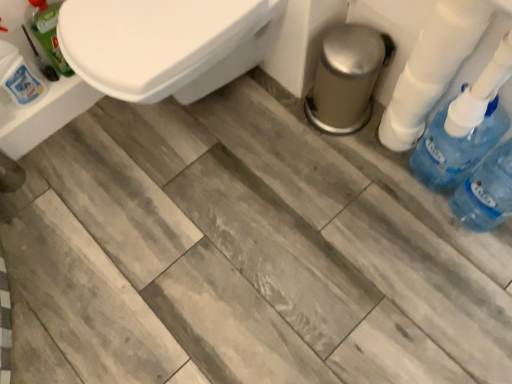
This screenshot has height=384, width=512. Find the location of `blue translucent bottle at right`. blue translucent bottle at right is located at coordinates (486, 192).

In order to face translucent green bottle at upper left, the 2th cleaning product positioned from the left, should I rotate leftwards or rightwards?

To align with it, rotate left about 25.118°.

This screenshot has width=512, height=384. I want to click on translucent plastic bottle at upper left, the third cleaning product when ordered from right to left, so click(18, 76).

Where is `blue translucent bottle at right`? The height and width of the screenshot is (384, 512). blue translucent bottle at right is located at coordinates (486, 192).

Consider the image. Which of these two, translucent green bottle at upper left, the 2th cleaning product positioned from the left, or blue translucent bottle at right, is bigger?

blue translucent bottle at right is bigger.

Is translucent green bottle at upper left, the 2th cleaning product positioned from the left, shorter than blue translucent bottle at right?

Yes, translucent green bottle at upper left, the 2th cleaning product positioned from the left, is shorter than blue translucent bottle at right.

Based on the photo, which is more to the left, translucent green bottle at upper left, marked as the second cleaning product in a right-to-left arrangement, or blue translucent bottle at right?

translucent green bottle at upper left, marked as the second cleaning product in a right-to-left arrangement.

Would you say translucent green bottle at upper left, the 2th cleaning product positioned from the left, contains blue translucent bottle at right?

That's incorrect, blue translucent bottle at right is not inside translucent green bottle at upper left, the 2th cleaning product positioned from the left.

From a real-world perspective, who is located lower, translucent plastic bottle at upper left, the first cleaning product in the left-to-right sequence, or white plastic toilet paper at right?

translucent plastic bottle at upper left, the first cleaning product in the left-to-right sequence.

Is point (31, 92) positioned after point (409, 147)?

Yes, it is behind point (409, 147).

Looking at this image, which object is further away from the camera taking this photo, translucent plastic bottle at upper left, the third cleaning product when ordered from right to left, or white plastic toilet paper at right?

translucent plastic bottle at upper left, the third cleaning product when ordered from right to left, is behind.

Looking at this image, is translucent plastic bottle at upper left, the first cleaning product in the left-to-right sequence, to the left or to the right of white plastic toilet paper at right in the image?

Based on their positions, translucent plastic bottle at upper left, the first cleaning product in the left-to-right sequence, is located to the left of white plastic toilet paper at right.

Is blue translucent bottle at right to the right of white plastic toilet paper at right from the viewer's perspective?

Yes, blue translucent bottle at right is to the right of white plastic toilet paper at right.

From a real-world perspective, is blue translucent bottle at right on top of white plastic toilet paper at right?

No, from a real-world perspective, blue translucent bottle at right is not over white plastic toilet paper at right

The image size is (512, 384). I want to click on bottle below the white plastic toilet paper at right (from the image's perspective), so click(x=486, y=192).

Is the depth of blue translucent bottle at right less than that of white plastic toilet paper at right?

No, blue translucent bottle at right is behind white plastic toilet paper at right.

Between point (478, 173) and point (476, 88), which one is positioned in front?

The point (476, 88) is closer.

From the image's perspective, is blue translucent bottle at right located above blue plastic bottle at right, which ranks as the third cleaning product in left-to-right order?

Incorrect, from the image's perspective, blue translucent bottle at right is lower than blue plastic bottle at right, which ranks as the third cleaning product in left-to-right order.

Are blue translucent bottle at right and blue plastic bottle at right, arranged as the 1th cleaning product when viewed from the right, far apart?

No, there isn't a large distance between blue translucent bottle at right and blue plastic bottle at right, arranged as the 1th cleaning product when viewed from the right.

Considering the sizes of blue translucent bottle at right and blue plastic bottle at right, arranged as the 1th cleaning product when viewed from the right, in the image, is blue translucent bottle at right bigger or smaller than blue plastic bottle at right, arranged as the 1th cleaning product when viewed from the right,?

blue translucent bottle at right is bigger than blue plastic bottle at right, arranged as the 1th cleaning product when viewed from the right.

From a real-world perspective, is blue translucent bottle at right located beneath translucent green bottle at upper left, the 2th cleaning product positioned from the left?

Yes, from a real-world perspective, blue translucent bottle at right is beneath translucent green bottle at upper left, the 2th cleaning product positioned from the left.

Does blue translucent bottle at right turn towards translucent green bottle at upper left, the 2th cleaning product positioned from the left?

No, blue translucent bottle at right does not turn towards translucent green bottle at upper left, the 2th cleaning product positioned from the left.

How far apart are blue translucent bottle at right and translucent green bottle at upper left, marked as the second cleaning product in a right-to-left arrangement?

blue translucent bottle at right is 3.79 feet from translucent green bottle at upper left, marked as the second cleaning product in a right-to-left arrangement.

Is the position of white plastic toilet paper at right less distant than that of translucent green bottle at upper left, the 2th cleaning product positioned from the left?

Yes, it is in front of translucent green bottle at upper left, the 2th cleaning product positioned from the left.

Is white plastic toilet paper at right thinner than translucent green bottle at upper left, the 2th cleaning product positioned from the left?

Yes, white plastic toilet paper at right is thinner than translucent green bottle at upper left, the 2th cleaning product positioned from the left.

Which is behind, point (459, 11) or point (72, 71)?

The point (72, 71) is more distant.

Are white plastic toilet paper at right and translucent green bottle at upper left, marked as the second cleaning product in a right-to-left arrangement, far apart?

No, white plastic toilet paper at right is in close proximity to translucent green bottle at upper left, marked as the second cleaning product in a right-to-left arrangement.

Between translucent green bottle at upper left, the 2th cleaning product positioned from the left, and blue plastic bottle at right, which ranks as the third cleaning product in left-to-right order, which one has larger size?

Bigger between the two is blue plastic bottle at right, which ranks as the third cleaning product in left-to-right order.

Does point (49, 7) appear closer or farther from the camera than point (478, 102)?

Point (49, 7) is farther from the camera than point (478, 102).

Which is correct: translucent green bottle at upper left, marked as the second cleaning product in a right-to-left arrangement, is inside blue plastic bottle at right, which ranks as the third cleaning product in left-to-right order, or outside of it?

translucent green bottle at upper left, marked as the second cleaning product in a right-to-left arrangement, lies outside blue plastic bottle at right, which ranks as the third cleaning product in left-to-right order.

In the image, there is a translucent green bottle at upper left, marked as the second cleaning product in a right-to-left arrangement. What are the coordinates of `bottle below it (from the image's perspective)` in the screenshot? It's located at (486, 192).

You are a GUI agent. You are given a task and a screenshot of the screen. Output one action in this format:
    pyautogui.click(x=<x>, y=<y>)
    Task: Click on the 1st cleaning product above when counting from the white plastic toilet paper at right (from the image's perspective)
    The height and width of the screenshot is (384, 512).
    Given the screenshot: What is the action you would take?
    pyautogui.click(x=18, y=76)

Estimate the real-world distances between objects in this image. Which object is further from blue translucent bottle at right, white plastic toilet paper at right or blue plastic bottle at right, which ranks as the third cleaning product in left-to-right order?

Among the two, white plastic toilet paper at right is located further to blue translucent bottle at right.

When comparing their distances from white plastic toilet paper at right, does blue translucent bottle at right or translucent plastic bottle at upper left, the first cleaning product in the left-to-right sequence, seem closer?

blue translucent bottle at right.

From the image, which object appears to be farther from white plastic toilet paper at right, translucent green bottle at upper left, the 2th cleaning product positioned from the left, or blue plastic bottle at right, which ranks as the third cleaning product in left-to-right order?

Among the two, translucent green bottle at upper left, the 2th cleaning product positioned from the left, is located further to white plastic toilet paper at right.

Which object lies nearer to the anchor point blue translucent bottle at right, blue plastic bottle at right, which ranks as the third cleaning product in left-to-right order, or white plastic toilet paper at right?

blue plastic bottle at right, which ranks as the third cleaning product in left-to-right order, is positioned closer to the anchor blue translucent bottle at right.

When comparing their distances from translucent plastic bottle at upper left, the first cleaning product in the left-to-right sequence, does white plastic toilet paper at right or blue translucent bottle at right seem further?

Based on the image, blue translucent bottle at right appears to be further to translucent plastic bottle at upper left, the first cleaning product in the left-to-right sequence.

Estimate the real-world distances between objects in this image. Which object is closer to translucent plastic bottle at upper left, the third cleaning product when ordered from right to left, white plastic toilet paper at right or translucent green bottle at upper left, the 2th cleaning product positioned from the left?

translucent green bottle at upper left, the 2th cleaning product positioned from the left.

Which object lies nearer to the anchor point translucent green bottle at upper left, marked as the second cleaning product in a right-to-left arrangement, translucent plastic bottle at upper left, the third cleaning product when ordered from right to left, or blue plastic bottle at right, arranged as the 1th cleaning product when viewed from the right?

Among the two, translucent plastic bottle at upper left, the third cleaning product when ordered from right to left, is located nearer to translucent green bottle at upper left, marked as the second cleaning product in a right-to-left arrangement.

When comparing their distances from blue translucent bottle at right, does blue plastic bottle at right, which ranks as the third cleaning product in left-to-right order, or translucent plastic bottle at upper left, the first cleaning product in the left-to-right sequence, seem further?

The object further to blue translucent bottle at right is translucent plastic bottle at upper left, the first cleaning product in the left-to-right sequence.

I want to click on cleaning product between translucent plastic bottle at upper left, the first cleaning product in the left-to-right sequence, and white plastic toilet paper at right, so click(x=48, y=32).

What are the coordinates of `toilet paper between translucent green bottle at upper left, the 2th cleaning product positioned from the left, and blue plastic bottle at right, which ranks as the third cleaning product in left-to-right order, in the horizontal direction` in the screenshot? It's located at (432, 68).

You are a GUI agent. You are given a task and a screenshot of the screen. Output one action in this format:
    pyautogui.click(x=<x>, y=<y>)
    Task: Click on the toilet paper between translucent green bottle at upper left, marked as the second cleaning product in a right-to-left arrangement, and blue translucent bottle at right
    This screenshot has height=384, width=512.
    Given the screenshot: What is the action you would take?
    pyautogui.click(x=432, y=68)

You are a GUI agent. You are given a task and a screenshot of the screen. Output one action in this format:
    pyautogui.click(x=<x>, y=<y>)
    Task: Click on the cleaning product situated between translucent plastic bottle at upper left, the third cleaning product when ordered from right to left, and blue plastic bottle at right, which ranks as the third cleaning product in left-to-right order, from left to right
    The image size is (512, 384).
    Given the screenshot: What is the action you would take?
    pyautogui.click(x=48, y=32)